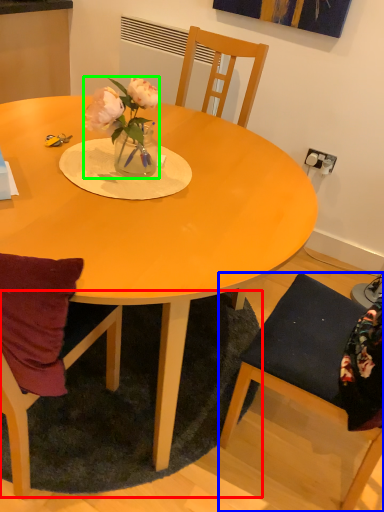
Question: Estimate the real-world distances between objects in this image. Which object is closer to mat (highlighted by a red box), chair (highlighted by a blue box) or houseplant (highlighted by a green box)?

Choices:
 (A) chair
 (B) houseplant

Answer: (A)